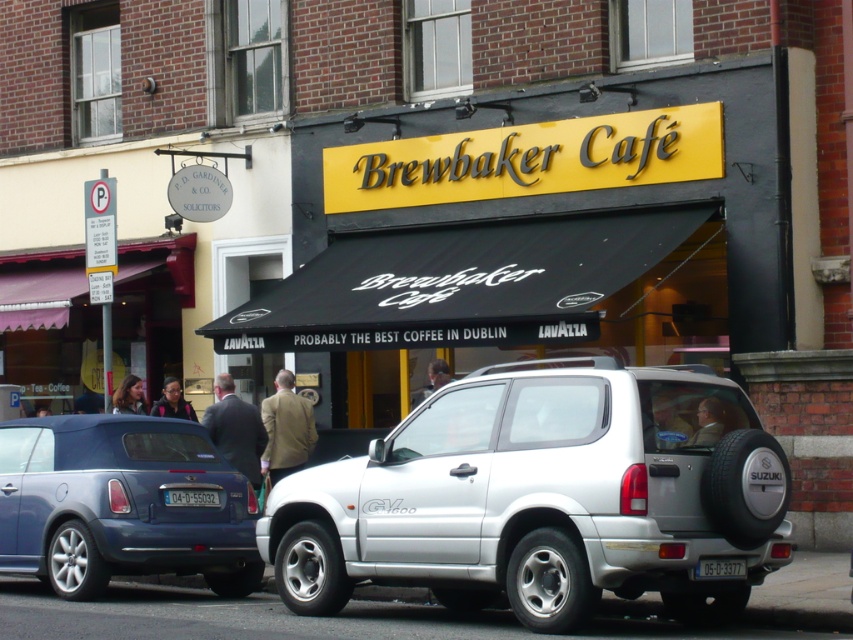
You are a pedestrian standing in front of Brewbaker Cafe. You see a metallic blue convertible at lower left and a dark brown leather jacket at center. Which object is closer to you?

The metallic blue convertible at lower left is positioned under dark brown leather jacket at center, so the metallic blue convertible at lower left is closer to you.

You are a delivery person trying to park your motorcycle between the metallic blue convertible at lower left and the dark brown leather jacket at center. Can your motorcycle fit in the space between them?

The metallic blue convertible at lower left is bigger than the dark brown leather jacket at center, but the exact distance between them isn not specified. Without knowing the space between the two objects, it is impossible to determine if the motorcycle can fit.